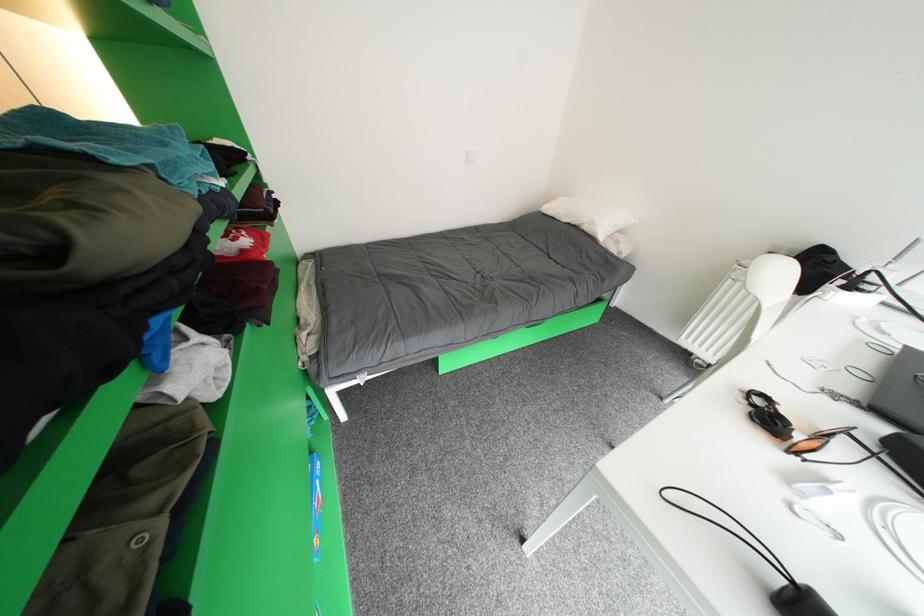
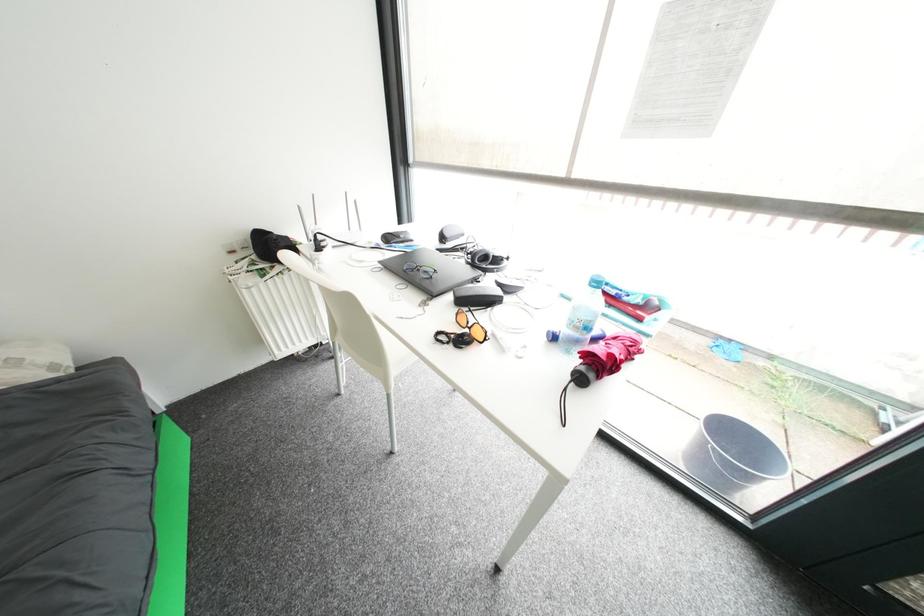
How did the camera likely rotate?

The camera's rotation is toward right-down.